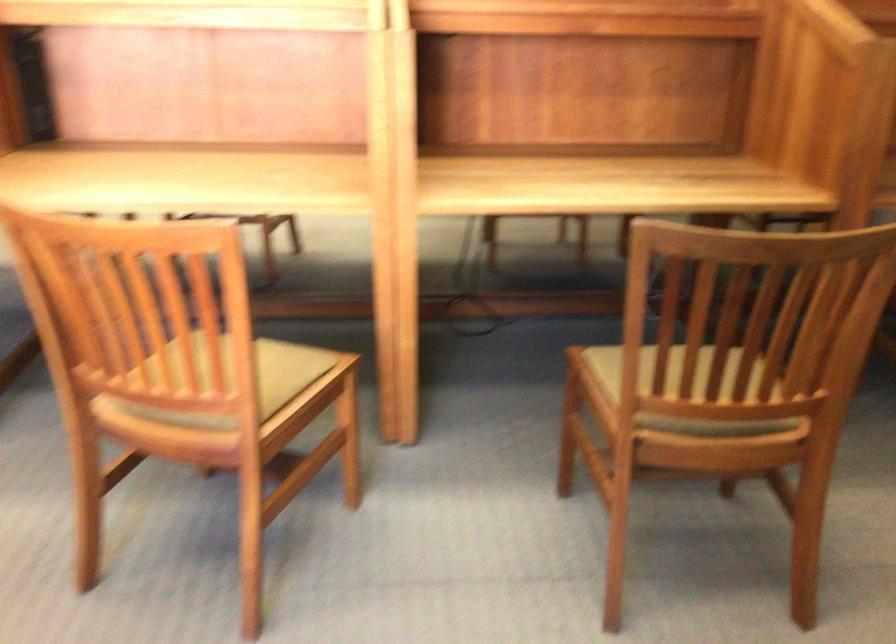
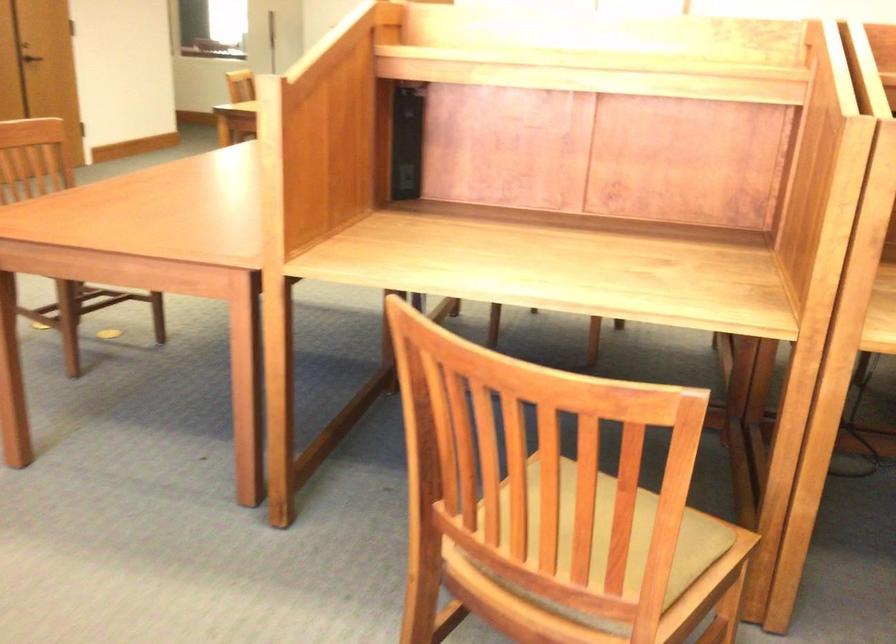
The point at (234, 377) is marked in the first image. Where is the corresponding point in the second image?

(651, 565)